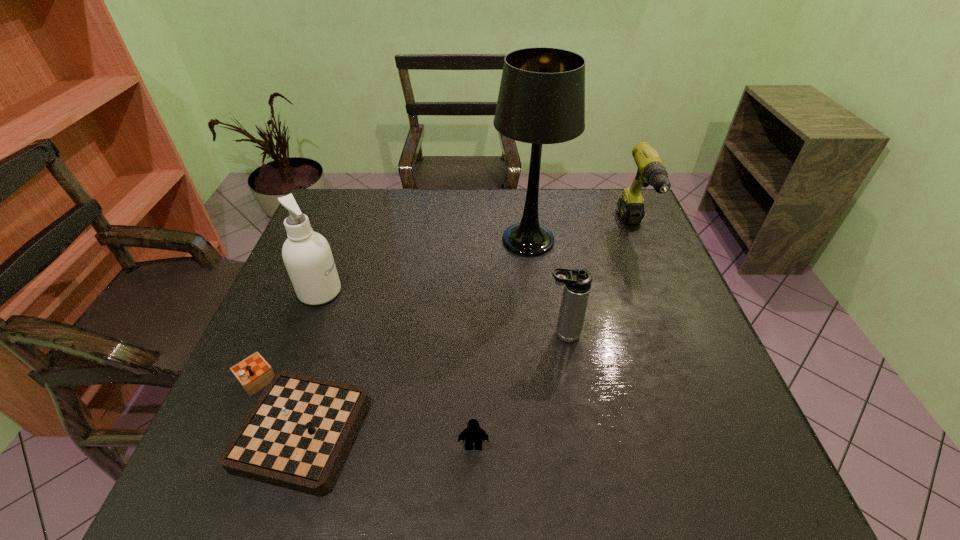
Where is `the tallest object`? This screenshot has width=960, height=540. the tallest object is located at coordinates (541, 100).

The image size is (960, 540). In order to click on cleansing agent in this screenshot , I will do `click(307, 255)`.

I want to click on the fourth shortest object, so click(651, 171).

Locate an element on the screen. Image resolution: width=960 pixels, height=540 pixels. drill is located at coordinates (651, 171).

At what (x,y) coordinates should I click in order to perform the action: click on thermos bottle. Please return your answer as a coordinate pair (x, y). Image resolution: width=960 pixels, height=540 pixels. Looking at the image, I should click on (577, 281).

This screenshot has height=540, width=960. What are the coordinates of `the third shortest object` in the screenshot? It's located at (577, 281).

The width and height of the screenshot is (960, 540). In order to click on Lego in this screenshot , I will do pyautogui.click(x=473, y=433).

The image size is (960, 540). Find the location of `the third object from left to right`. the third object from left to right is located at coordinates (473, 433).

Locate an element on the screen. chessboard is located at coordinates (296, 436).

Find the location of `vacant space located on the left of the table lamp`. vacant space located on the left of the table lamp is located at coordinates (461, 240).